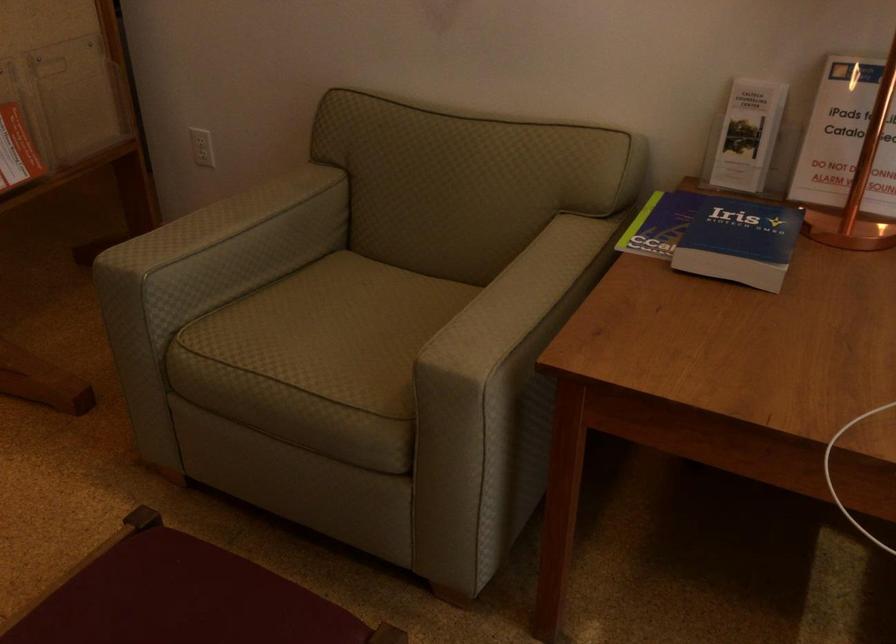
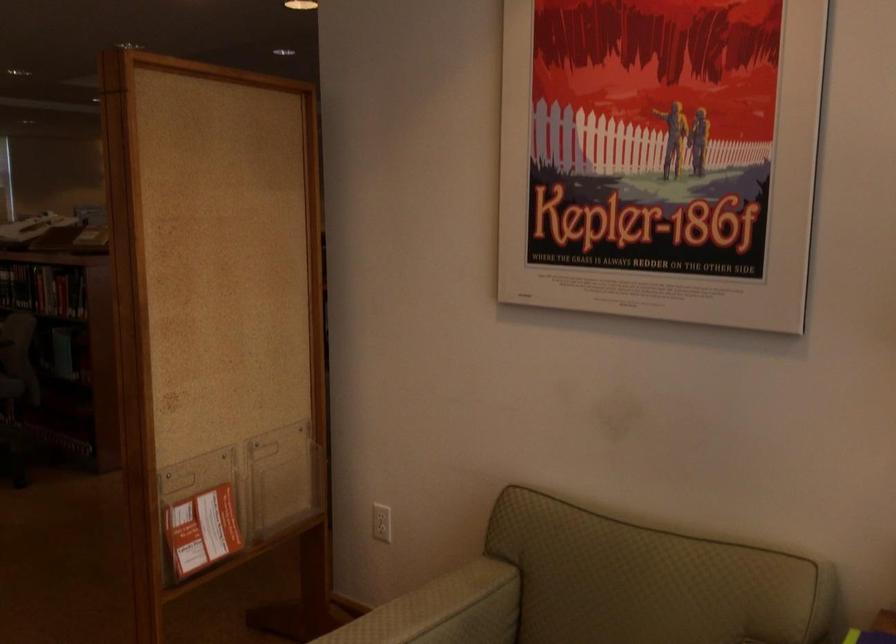
Question: Based on the continuous images, in which direction is the camera rotating? Reply with the corresponding letter.

Choices:
 (A) Left
 (B) Right
 (C) Up
 (D) Down

Answer: (C)